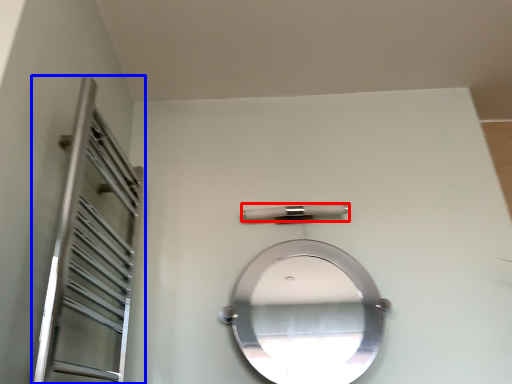
Question: Which object is further to the camera taking this photo, door handle (highlighted by a red box) or screen door (highlighted by a blue box)?

Choices:
 (A) door handle
 (B) screen door

Answer: (A)